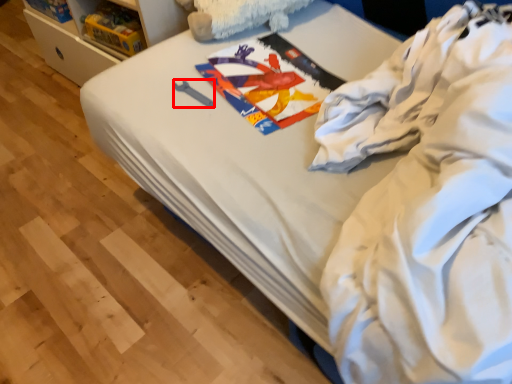
Question: Where is equipment (annotated by the red box) located in relation to clothing in the image?

Choices:
 (A) right
 (B) left

Answer: (B)